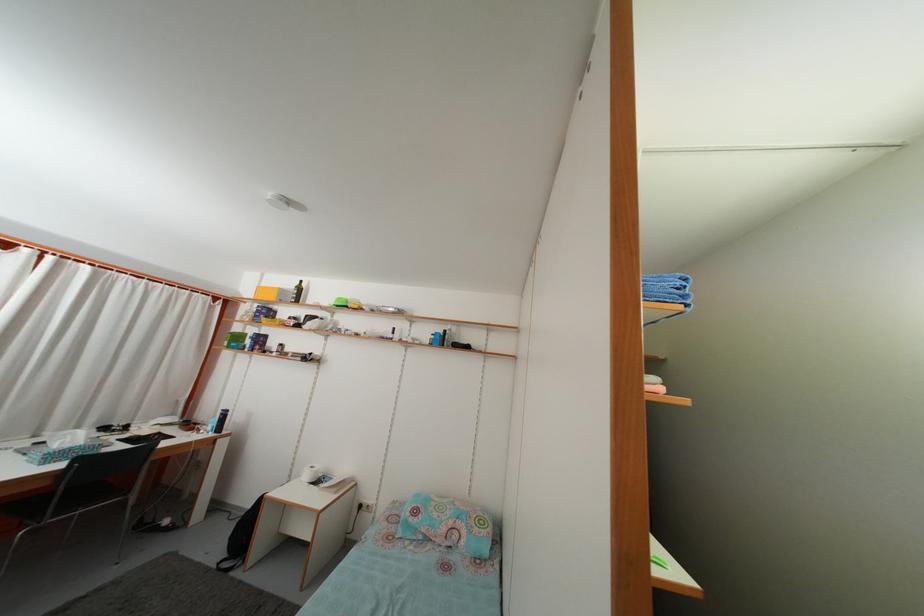
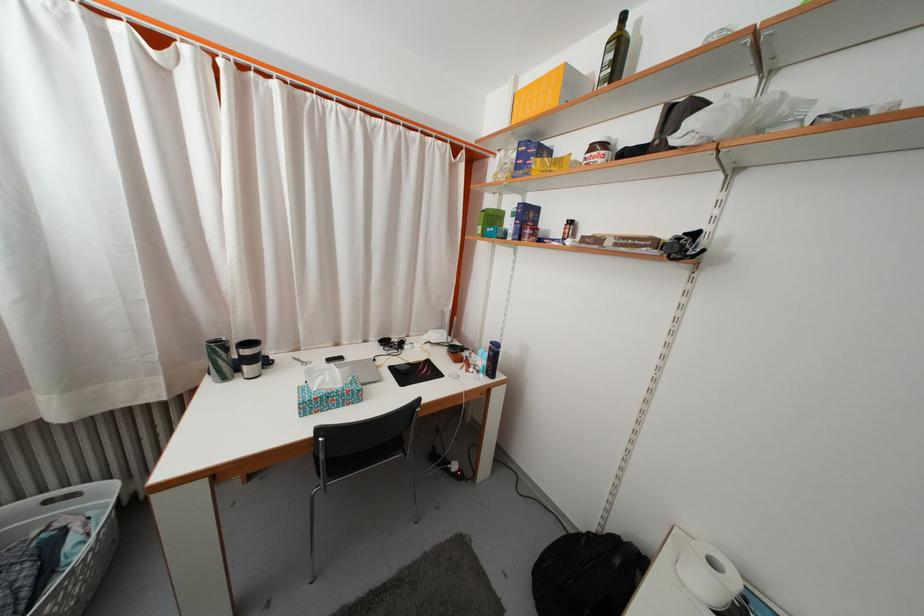
Where in the second image is the point corresponding to pixel 306 297 from the first image?

(625, 54)